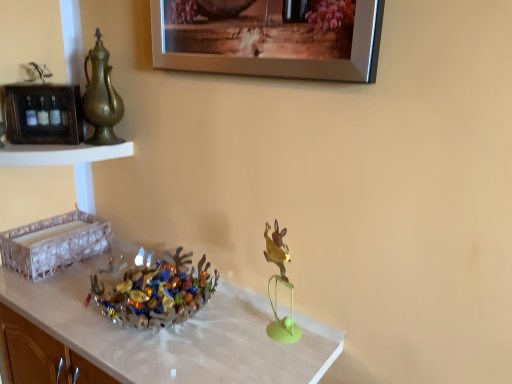
What do you see at coordinates (42, 113) in the screenshot? The width and height of the screenshot is (512, 384). I see `wooden frame at left, which is the first shelf in top-to-bottom order` at bounding box center [42, 113].

Measure the distance between white textured tray at upper left and camera.

white textured tray at upper left and camera are 1.04 meters apart.

What do you see at coordinates (101, 97) in the screenshot?
I see `gold metallic teapot at left` at bounding box center [101, 97].

What do you see at coordinates (54, 243) in the screenshot? I see `translucent glass tray at left, which is the 2th shelf from top to bottom` at bounding box center [54, 243].

Find the location of a particular element. wooden frame at left, the 2th shelf from the bottom is located at coordinates (42, 113).

Is wooden frame at left, the 2th shelf from the bottom, oriented away from metallic gold rabbit at center?

No, wooden frame at left, the 2th shelf from the bottom, is not facing away from metallic gold rabbit at center.

Considering the points (48, 133) and (268, 250), which point is in front, point (48, 133) or point (268, 250)?

The point (268, 250) is more forward.

How many degrees apart are the facing directions of wooden frame at left, the 2th shelf from the bottom, and metallic gold rabbit at center?

40.3 degrees separate the facing orientations of wooden frame at left, the 2th shelf from the bottom, and metallic gold rabbit at center.

Locate an element on the screen. toy located underneath the wooden frame at left, which is the first shelf in top-to-bottom order (from a real-world perspective) is located at coordinates (282, 283).

Considering the sizes of objects white textured tray at upper left and translucent glass tray at left, positioned as the first shelf in bottom-to-top order, in the image provided, who is bigger, white textured tray at upper left or translucent glass tray at left, positioned as the first shelf in bottom-to-top order,?

white textured tray at upper left.

In order to click on the 2nd shelf counting from the left side of the white textured tray at upper left in this screenshot , I will do `click(54, 243)`.

Is white textured tray at upper left located outside translucent glass tray at left, positioned as the first shelf in bottom-to-top order?

Indeed, white textured tray at upper left is completely outside translucent glass tray at left, positioned as the first shelf in bottom-to-top order.

Considering the positions of points (77, 204) and (3, 255), is point (77, 204) closer to camera compared to point (3, 255)?

No, it is behind (3, 255).

From a real-world perspective, is white textured tray at upper left above or below gold metallic teapot at left?

From a real-world perspective, white textured tray at upper left is physically below gold metallic teapot at left.

Identify the location of vanity below the gold metallic teapot at left (from the image's perspective). The height and width of the screenshot is (384, 512). tap(67, 163).

Is white textured tray at upper left inside or outside of gold metallic teapot at left?

white textured tray at upper left is not enclosed by gold metallic teapot at left.

Is white textured tray at upper left beside wooden frame at left, the 2th shelf from the bottom?

No, white textured tray at upper left is not in contact with wooden frame at left, the 2th shelf from the bottom.

Does white textured tray at upper left have a larger size compared to wooden frame at left, which is the first shelf in top-to-bottom order?

Indeed, white textured tray at upper left has a larger size compared to wooden frame at left, which is the first shelf in top-to-bottom order.

Can you tell me how much white textured tray at upper left and wooden frame at left, the 2th shelf from the bottom, differ in facing direction?

48.9 degrees separate the facing orientations of white textured tray at upper left and wooden frame at left, the 2th shelf from the bottom.

From the picture: In terms of height, does white textured tray at upper left look taller or shorter compared to wooden frame at left, the 2th shelf from the bottom?

Considering their sizes, white textured tray at upper left has less height than wooden frame at left, the 2th shelf from the bottom.

The image size is (512, 384). In order to click on toy located underneath the gold metallic teapot at left (from a real-world perspective) in this screenshot , I will do `click(282, 283)`.

Consider the image. Considering the positions of objects gold metallic teapot at left and metallic gold rabbit at center in the image provided, who is more to the right, gold metallic teapot at left or metallic gold rabbit at center?

From the viewer's perspective, metallic gold rabbit at center appears more on the right side.

Does gold metallic teapot at left have a lesser height compared to metallic gold rabbit at center?

Incorrect, the height of gold metallic teapot at left does not fall short of that of metallic gold rabbit at center.

Between gold metallic teapot at left and metallic gold rabbit at center, which one has larger width?

With larger width is metallic gold rabbit at center.

Does metallic gold rabbit at center turn towards translucent glass tray at left, positioned as the first shelf in bottom-to-top order?

No.

Considering the points (289, 319) and (62, 264), which point is in front, point (289, 319) or point (62, 264)?

The point (289, 319) is closer.

From the image's perspective, does metallic gold rabbit at center appear higher than translucent glass tray at left, which is the 2th shelf from top to bottom?

No, from the image's perspective, metallic gold rabbit at center is not over translucent glass tray at left, which is the 2th shelf from top to bottom.

Does metallic gold rabbit at center have a greater height compared to translucent glass tray at left, positioned as the first shelf in bottom-to-top order?

Yes, metallic gold rabbit at center is taller than translucent glass tray at left, positioned as the first shelf in bottom-to-top order.

From the image's perspective, which one is positioned lower, silver metallic picture frame at upper center or metallic gold rabbit at center?

metallic gold rabbit at center appears lower in the image.

Does silver metallic picture frame at upper center come in front of metallic gold rabbit at center?

Yes, silver metallic picture frame at upper center is closer to the camera.

I want to click on toy behind the silver metallic picture frame at upper center, so click(282, 283).

Considering the sizes of objects silver metallic picture frame at upper center and metallic gold rabbit at center in the image provided, who is smaller, silver metallic picture frame at upper center or metallic gold rabbit at center?

metallic gold rabbit at center is smaller.

At what (x,y) coordinates should I click in order to perform the action: click on shelf above the metallic gold rabbit at center (from a real-world perspective). Please return your answer as a coordinate pair (x, y). This screenshot has height=384, width=512. Looking at the image, I should click on (42, 113).

Where is `vanity above the translucent glass tray at left, positioned as the first shelf in bottom-to-top order (from the image's perspective)`? This screenshot has width=512, height=384. vanity above the translucent glass tray at left, positioned as the first shelf in bottom-to-top order (from the image's perspective) is located at coordinates (67, 163).

Considering their positions, is translucent glass bowl at center positioned further to white textured tray at upper left than metallic gold rabbit at center?

metallic gold rabbit at center is positioned further to the anchor white textured tray at upper left.

When comparing their distances from silver metallic picture frame at upper center, does metallic gold rabbit at center or translucent glass tray at left, positioned as the first shelf in bottom-to-top order, seem further?

translucent glass tray at left, positioned as the first shelf in bottom-to-top order, is positioned further to the anchor silver metallic picture frame at upper center.

Which object lies further to the anchor point gold metallic teapot at left, wooden frame at left, the 2th shelf from the bottom, or translucent glass tray at left, which is the 2th shelf from top to bottom?

The object further to gold metallic teapot at left is translucent glass tray at left, which is the 2th shelf from top to bottom.

Based on their spatial positions, is metallic gold rabbit at center or wooden frame at left, the 2th shelf from the bottom, further from gold metallic teapot at left?

metallic gold rabbit at center is further to gold metallic teapot at left.

Estimate the real-world distances between objects in this image. Which object is closer to translucent glass bowl at center, metallic gold rabbit at center or gold metallic teapot at left?

Based on the image, metallic gold rabbit at center appears to be nearer to translucent glass bowl at center.

Considering their positions, is white textured tray at upper left positioned closer to translucent glass bowl at center than silver metallic picture frame at upper center?

white textured tray at upper left.

Which object lies further to the anchor point wooden frame at left, which is the first shelf in top-to-bottom order, white textured tray at upper left or metallic gold rabbit at center?

metallic gold rabbit at center lies further to wooden frame at left, which is the first shelf in top-to-bottom order, than the other object.

Estimate the real-world distances between objects in this image. Which object is closer to metallic gold rabbit at center, translucent glass bowl at center or translucent glass bowl at center?

Based on the image, translucent glass bowl at center appears to be nearer to metallic gold rabbit at center.

What are the coordinates of `vanity between translucent glass tray at left, which is the 2th shelf from top to bottom, and metallic gold rabbit at center from left to right` in the screenshot? It's located at (67, 163).

In order to click on vanity between translucent glass tray at left, which is the 2th shelf from top to bottom, and silver metallic picture frame at upper center in this screenshot , I will do `click(67, 163)`.

Find the location of a particular element. The width and height of the screenshot is (512, 384). floral arrangement between white textured tray at upper left and translucent glass bowl at center in the up-down direction is located at coordinates (155, 291).

You are a GUI agent. You are given a task and a screenshot of the screen. Output one action in this format:
    pyautogui.click(x=<x>, y=<y>)
    Task: Click on the floral arrangement that lies between wooden frame at left, which is the first shelf in top-to-bottom order, and translucent glass bowl at center from top to bottom
    The height and width of the screenshot is (384, 512).
    Given the screenshot: What is the action you would take?
    pyautogui.click(x=155, y=291)